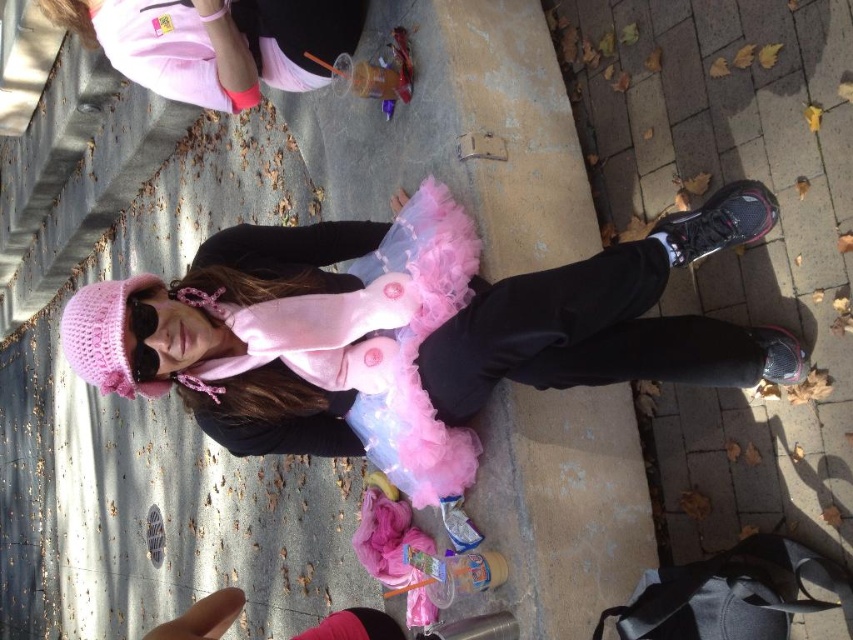
The height and width of the screenshot is (640, 853). What are the coordinates of `fuzzy pink dress at center` in the screenshot? It's located at (381, 344).

You are a GUI agent. You are given a task and a screenshot of the screen. Output one action in this format:
    pyautogui.click(x=<x>, y=<y>)
    Task: Click on the fuzzy pink dress at center
    The height and width of the screenshot is (640, 853).
    Given the screenshot: What is the action you would take?
    pyautogui.click(x=381, y=344)

Locate an element on the screen. Image resolution: width=853 pixels, height=640 pixels. fuzzy pink dress at center is located at coordinates (381, 344).

Which is below, fuzzy pink tutu at center or fuzzy pink dress at center?

fuzzy pink tutu at center is below.

Can you confirm if fuzzy pink tutu at center is taller than fuzzy pink dress at center?

In fact, fuzzy pink tutu at center may be shorter than fuzzy pink dress at center.

Which is in front, point (764, 193) or point (450, 234)?

Point (764, 193) is in front.

Identify the location of fuzzy pink tutu at center. This screenshot has width=853, height=640. (422, 332).

Which is more to the left, fuzzy pink tutu at center or pink fabric dress at upper left?

From the viewer's perspective, pink fabric dress at upper left appears more on the left side.

Is point (267, 273) farther from camera compared to point (225, 67)?

No, it is not.

You are a GUI agent. You are given a task and a screenshot of the screen. Output one action in this format:
    pyautogui.click(x=<x>, y=<y>)
    Task: Click on the fuzzy pink tutu at center
    
    Given the screenshot: What is the action you would take?
    pyautogui.click(x=422, y=332)